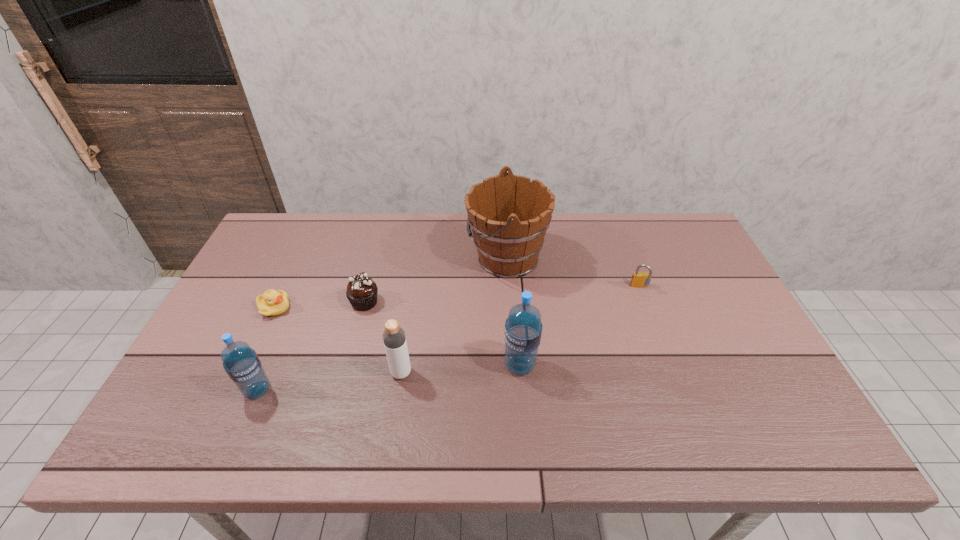
Where is `free space that is in between the cupcake and the right water bottle`? The height and width of the screenshot is (540, 960). free space that is in between the cupcake and the right water bottle is located at coordinates (443, 334).

The image size is (960, 540). In order to click on vacant space that's between the duckling and the shorter water bottle in this screenshot , I will do pyautogui.click(x=266, y=349).

This screenshot has height=540, width=960. What are the coordinates of `vacant space that is in between the shorter water bottle and the rightmost object` in the screenshot? It's located at (448, 339).

Where is `free area in between the right water bottle and the rightmost object`? The width and height of the screenshot is (960, 540). free area in between the right water bottle and the rightmost object is located at coordinates (580, 326).

Locate which object is the fourth closest to the shorter water bottle. Please provide its 2D coordinates. Your answer should be formatted as a tuple, i.e. [(x, y)], where the tuple contains the x and y coordinates of a point satisfying the conditions above.

[(509, 215)]

Where is `the fifth closest object to the bottle`? The image size is (960, 540). the fifth closest object to the bottle is located at coordinates (272, 303).

At what (x,y) coordinates should I click in order to perform the action: click on vacant space that satisfies the following two spatial constraints: 1. with the handle on the wine bucket; 2. on the front side of the shorter water bottle. Please return your answer as a coordinate pair (x, y). This screenshot has height=540, width=960. Looking at the image, I should click on (516, 390).

At what (x,y) coordinates should I click in order to perform the action: click on free space in the image that satisfies the following two spatial constraints: 1. on the back side of the left water bottle; 2. at the face of the shortest object. Please return your answer as a coordinate pair (x, y). Image resolution: width=960 pixels, height=540 pixels. Looking at the image, I should click on (293, 308).

Image resolution: width=960 pixels, height=540 pixels. Find the location of `free location that satisfies the following two spatial constraints: 1. at the face of the shortest object; 2. on the left side of the bottle`. free location that satisfies the following two spatial constraints: 1. at the face of the shortest object; 2. on the left side of the bottle is located at coordinates (244, 373).

At what (x,y) coordinates should I click in order to perform the action: click on free space that satisfies the following two spatial constraints: 1. at the face of the bottle; 2. on the right side of the duckling. Please return your answer as a coordinate pair (x, y). This screenshot has height=540, width=960. Looking at the image, I should click on (244, 373).